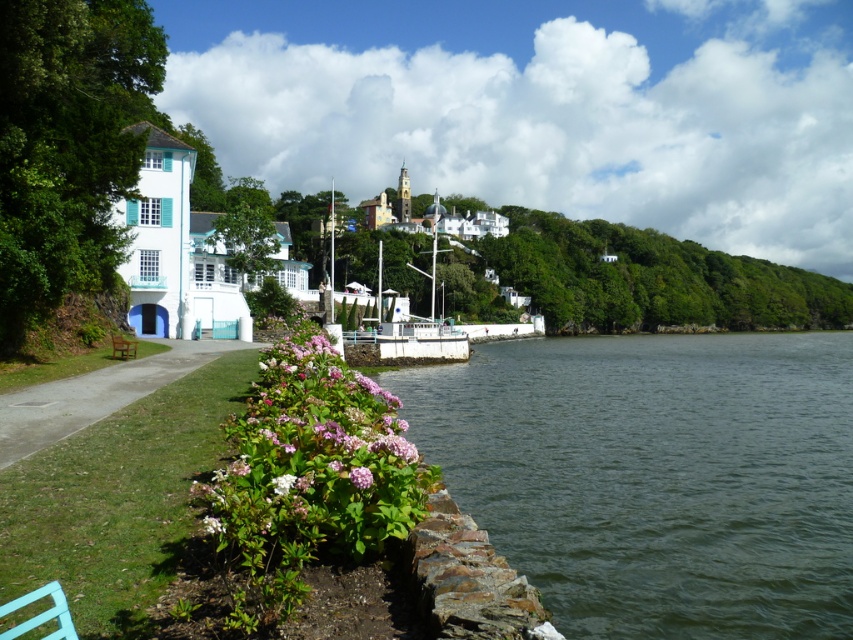
Is brown wooden bench at lower left to the left of white matte flower at lower center from the viewer's perspective?

Correct, you'll find brown wooden bench at lower left to the left of white matte flower at lower center.

Find the location of a particular element. brown wooden bench at lower left is located at coordinates (122, 348).

Is point (253, 504) farther from camera compared to point (74, 406)?

No.

Between pink matte hydrangea at center and gray concrete path at lower left, which one appears on the right side from the viewer's perspective?

From the viewer's perspective, pink matte hydrangea at center appears more on the right side.

Which is in front, point (335, 429) or point (4, 412)?

Point (335, 429) is more forward.

Where is `pink matte hydrangea at center`? This screenshot has height=640, width=853. pink matte hydrangea at center is located at coordinates (315, 456).

Is pink matte hydrangea at center below purple matte hydrangea at center?

Actually, pink matte hydrangea at center is above purple matte hydrangea at center.

Based on the photo, which of these two, pink matte hydrangea at center or purple matte hydrangea at center, stands shorter?

purple matte hydrangea at center

Who is more distant from viewer, (289, 532) or (363, 472)?

Point (363, 472)

Where is `pink matte hydrangea at center`? pink matte hydrangea at center is located at coordinates (315, 456).